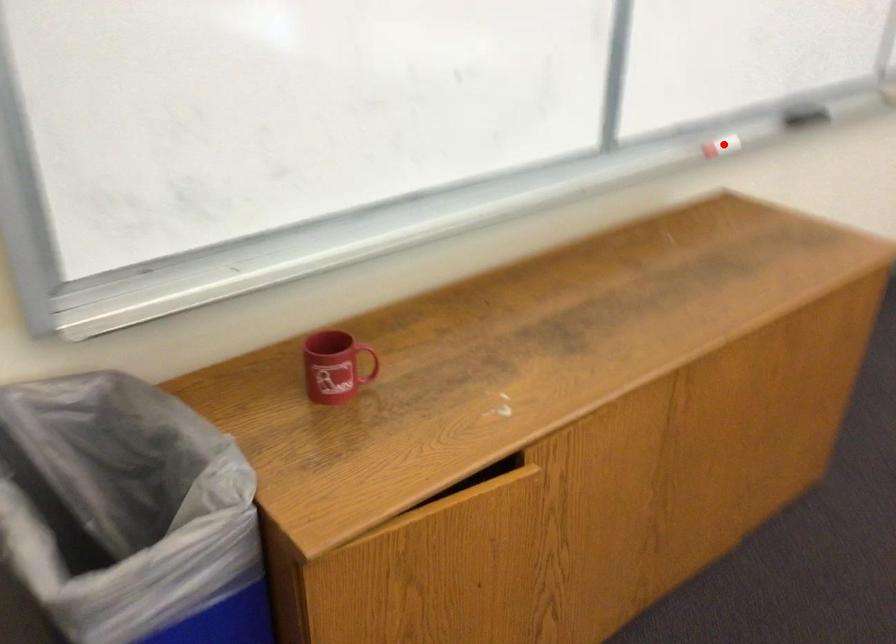
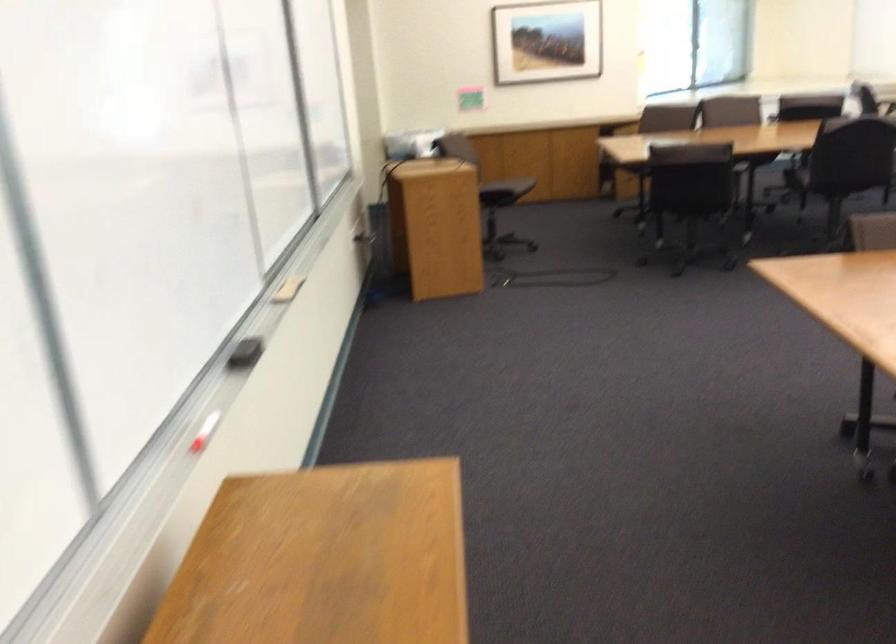
Find the pixel in the second image that matches the highlighted location in the first image.

(205, 431)